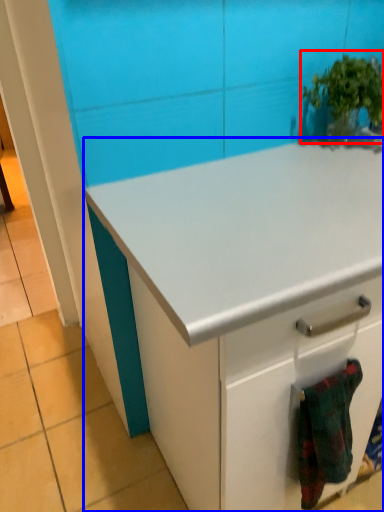
Question: Which object appears farthest to the camera in this image, houseplant (highlighted by a red box) or cabinetry (highlighted by a blue box)?

Choices:
 (A) houseplant
 (B) cabinetry

Answer: (A)